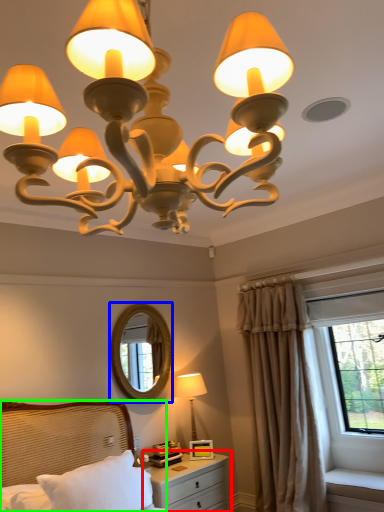
Question: Which object is the closest to the nightstand (highlighted by a red box)? Choose among these: mirror (highlighted by a blue box) or bed (highlighted by a green box).

Choices:
 (A) mirror
 (B) bed

Answer: (B)